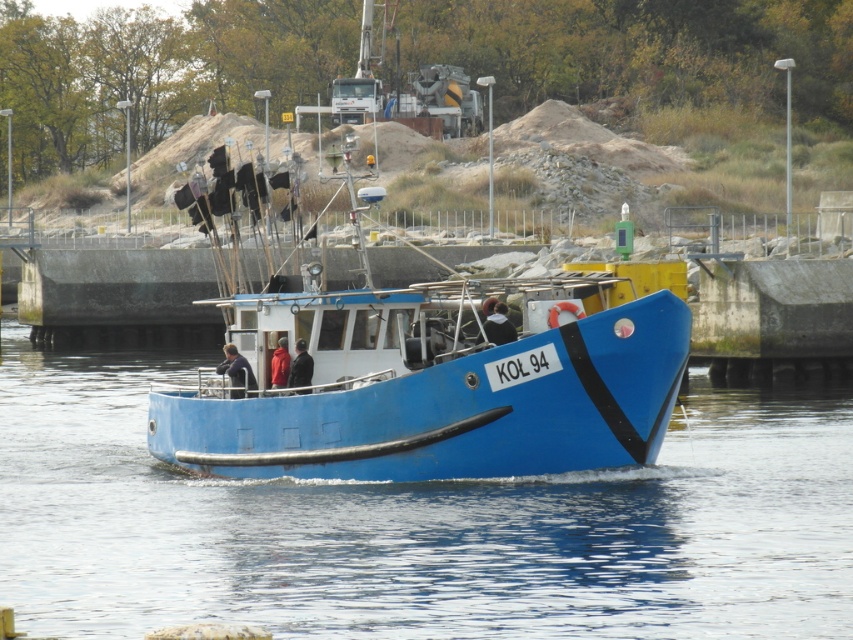
In the scene shown: Measure the distance between blue rubber boat at center and camera.

They are 32.40 meters apart.

Who is higher up, blue rubber boat at center or blue matte boat at center?

Positioned higher is blue matte boat at center.

Is point (393, 531) positioned behind point (160, 428)?

No, it is in front of (160, 428).

The width and height of the screenshot is (853, 640). I want to click on blue rubber boat at center, so click(421, 525).